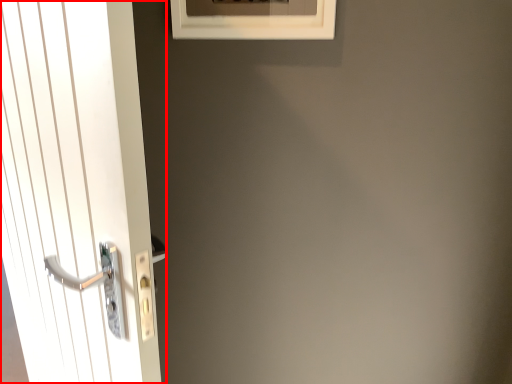
Question: From the image's perspective, what is the correct spatial relationship of door (annotated by the red box) in relation to window?

Choices:
 (A) below
 (B) above

Answer: (A)